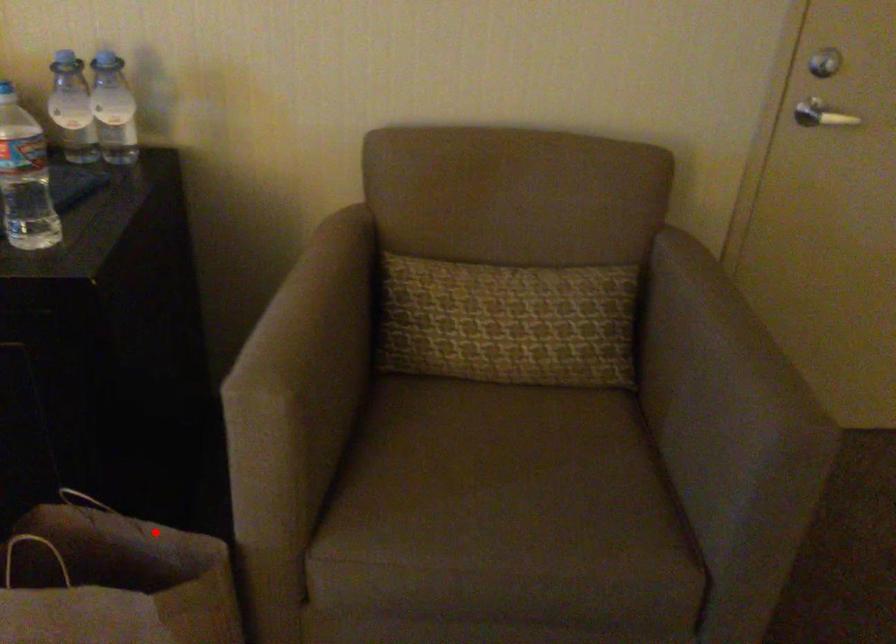
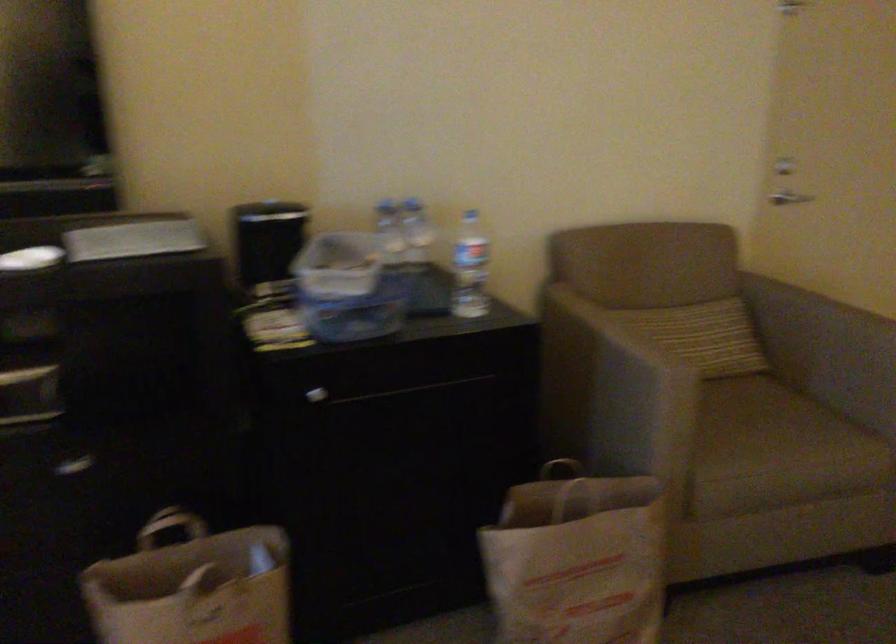
The point at the highlighted location is marked in the first image. Where is the corresponding point in the second image?

(576, 493)